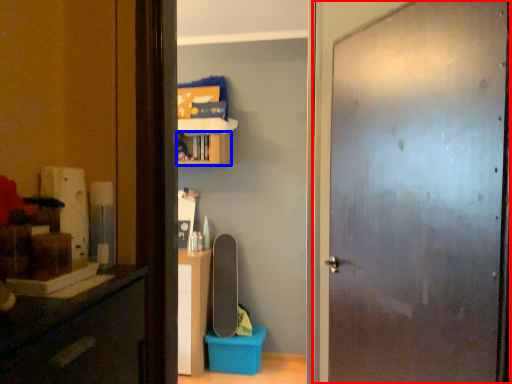
Question: Which point is further to the camera, door (highlighted by a red box) or cabinet (highlighted by a blue box)?

Choices:
 (A) door
 (B) cabinet

Answer: (B)